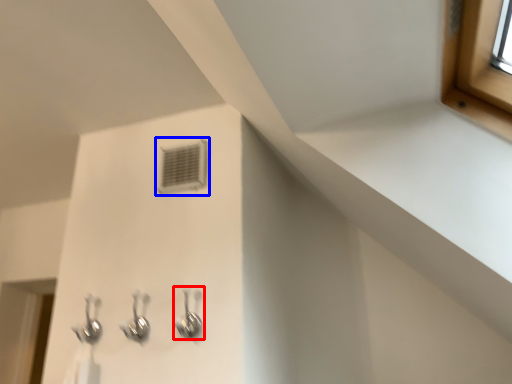
Question: Which object appears closest to the camera in this image, plumbing fixture (highlighted by a red box) or air conditioning (highlighted by a blue box)?

Choices:
 (A) plumbing fixture
 (B) air conditioning

Answer: (A)